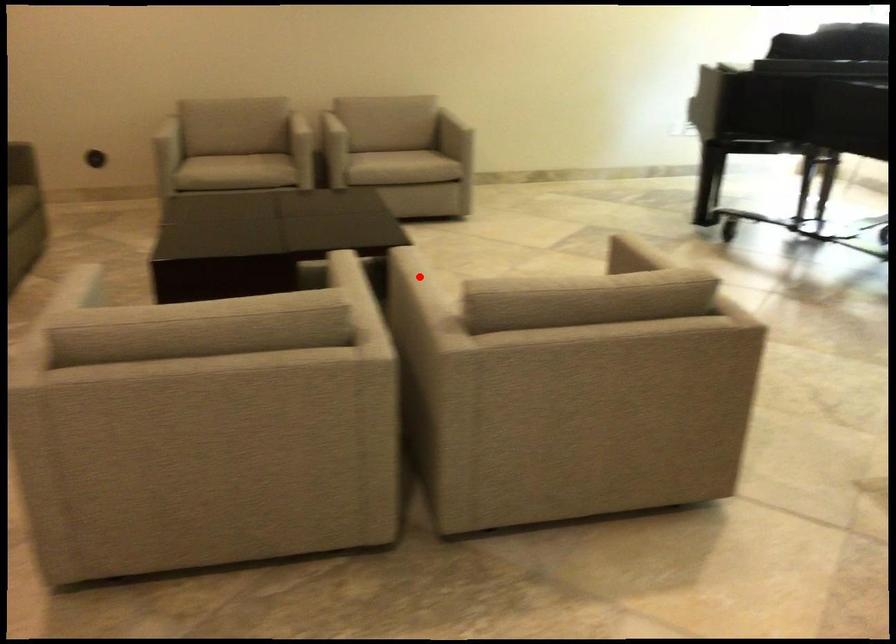
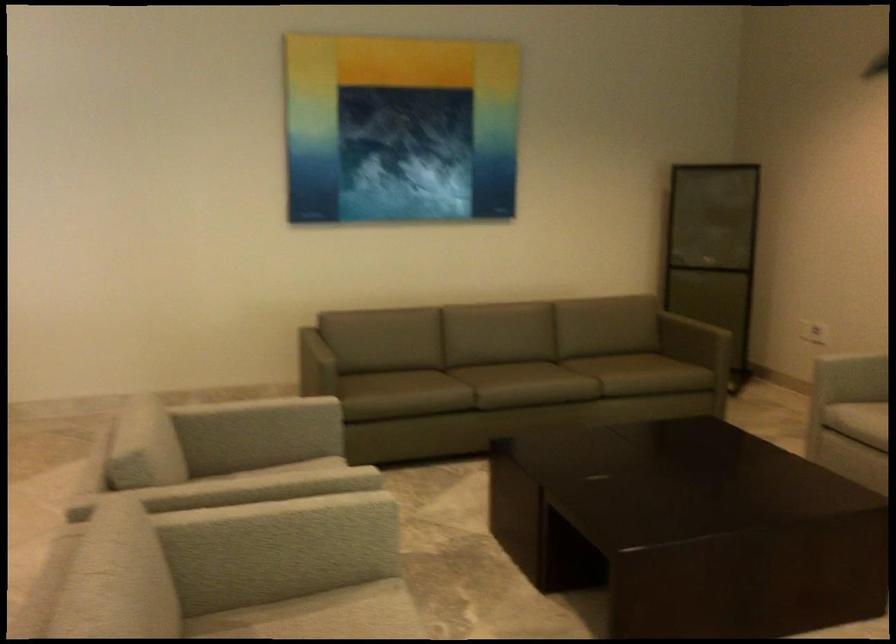
Locate, in the second image, the point that corresponds to the highlighted location in the first image.

(289, 529)